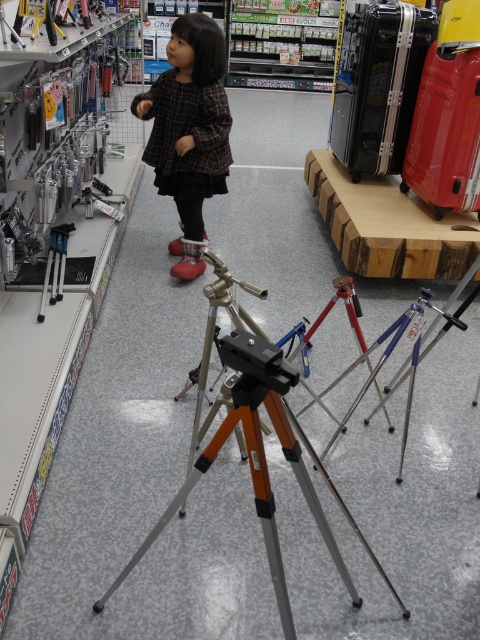
Find the location of a particular element. The image size is (480, 640). silver metallic tripod at center is located at coordinates (257, 442).

Which is in front, point (391, 584) or point (173, 154)?

Point (391, 584)

Identify the location of silver metallic tripod at center. (257, 442).